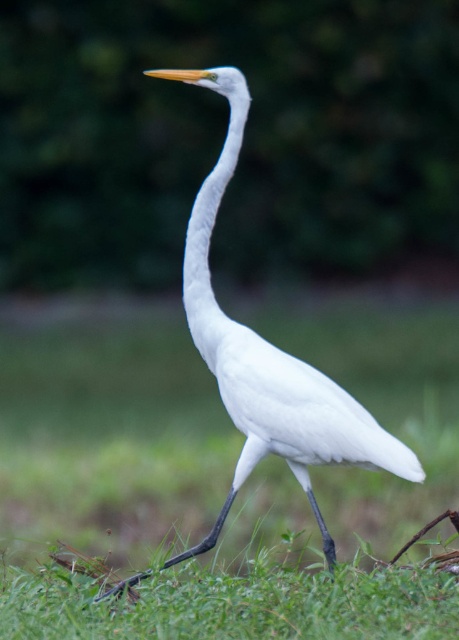
Who is positioned more to the right, white matte bird at center or white smooth neck at center?

Positioned to the right is white matte bird at center.

The height and width of the screenshot is (640, 459). Describe the element at coordinates (268, 356) in the screenshot. I see `white matte bird at center` at that location.

Measure the distance between point (x=202, y=260) and camera.

Point (x=202, y=260) is 3.48 meters away from camera.

Locate an element on the screen. This screenshot has width=459, height=640. white matte bird at center is located at coordinates (268, 356).